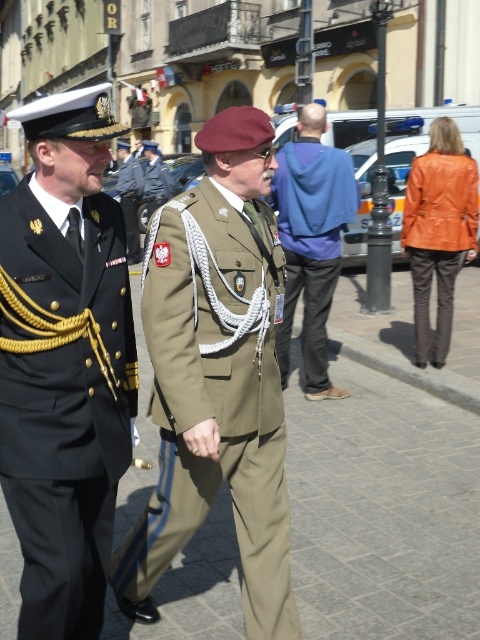
You are a photographer standing in the background of the scene. You want to take a photo that includes both the olive green fabric uniform at center and the khaki fabric uniform at center. What is the minimum distance you need to move backward to ensure both are in frame?

The minimum distance you need to move backward to ensure both the olive green fabric uniform at center and the khaki fabric uniform at center are in frame is determined by the distance between them, which is 11.13 meters. However, the exact distance you need to move depends on your camera lens and sensor size. Since the problem doesn

You are a photographer standing in the background of the scene. You want to take a photo of the blue fleece at center. Where should you aim your camera to capture it?

The blue fleece at center is located at the 2D coordinates point [311,241], so you should aim your camera at that position to capture it.